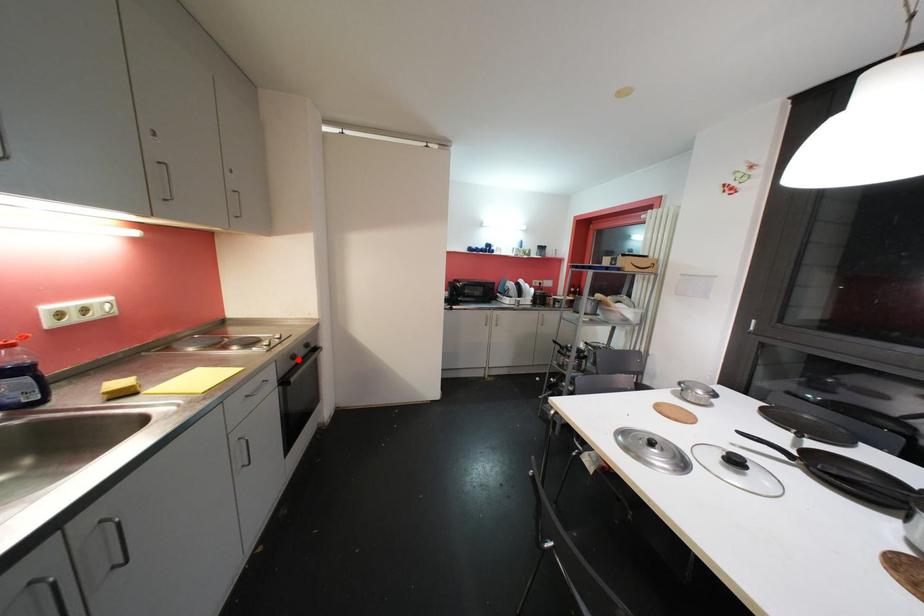
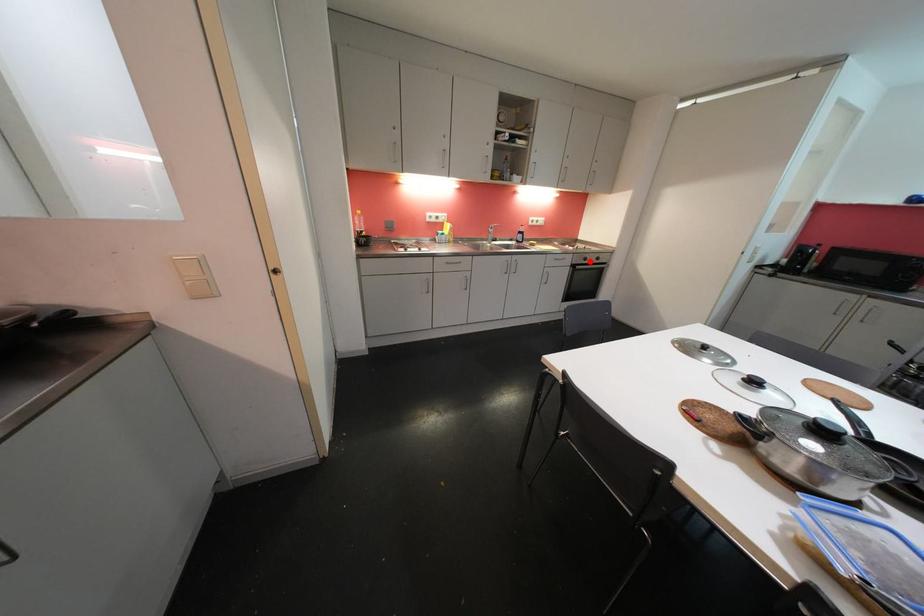
I am providing you with two images of the same scene from different viewpoints. A red point is marked on the first image and another point is marked on the second image. Is the red point in image1 aligned with the point shown in image2?

Yes